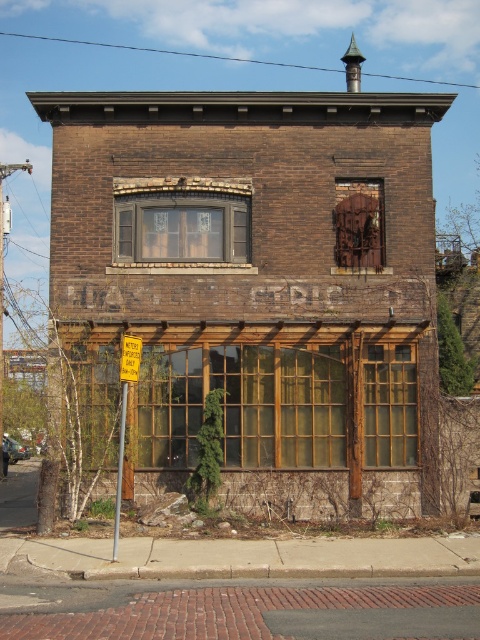
Between wooden-framed glass at center-right and yellow plastic sign at center, which one appears on the left side from the viewer's perspective?

yellow plastic sign at center is more to the left.

Is wooden-framed glass at center-right behind yellow plastic sign at center?

Yes, it is.

Does point (416, 387) come in front of point (122, 362)?

No, it is not.

The image size is (480, 640). In order to click on wooden-framed glass at center-right in this screenshot , I will do click(x=389, y=404).

Does rusty metal window at center appear under yellow plastic sign at lower left?

Incorrect, rusty metal window at center is not positioned below yellow plastic sign at lower left.

Is rusty metal window at center smaller than yellow plastic sign at lower left?

No.

Does point (371, 260) come in front of point (140, 358)?

No.

Locate an element on the screen. The height and width of the screenshot is (640, 480). rusty metal window at center is located at coordinates (359, 224).

Can you confirm if wooden-framed glass at center-right is smaller than rusty metal window at center?

Correct, wooden-framed glass at center-right occupies less space than rusty metal window at center.

In the scene shown: Can you confirm if wooden-framed glass at center-right is positioned above rusty metal window at center?

No, wooden-framed glass at center-right is not above rusty metal window at center.

Does point (372, 392) lie behind point (369, 211)?

That is False.

The height and width of the screenshot is (640, 480). Identify the location of wooden-framed glass at center-right. (389, 404).